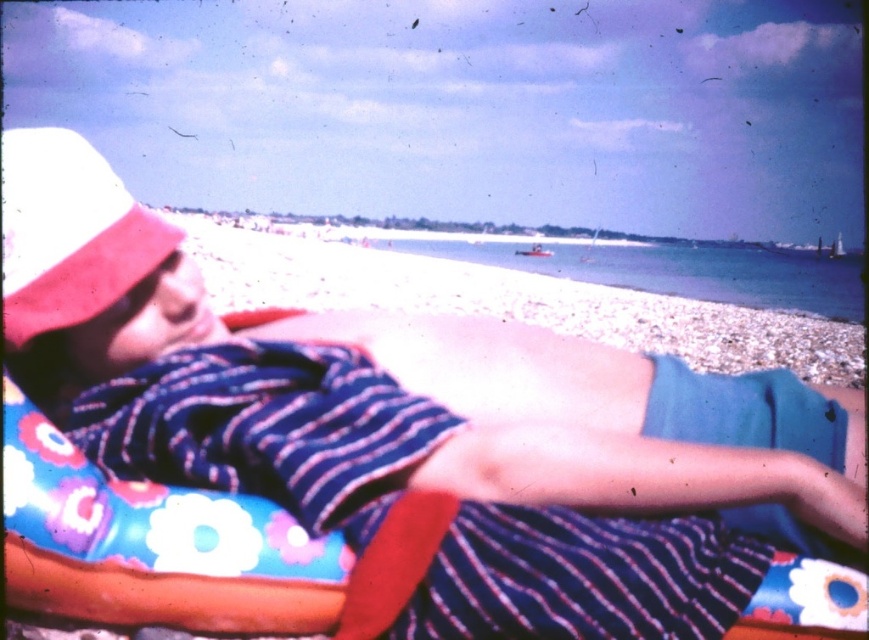
You are standing on the beach and see two points marked on the ground. The first point is at coordinate point [313,241] and the second is at point [98,241]. Which point is closer to you?

Point [313,241] is further to the viewer than point [98,241], so the closer point to you is point [98,241].

You are standing on the beach and want to place a 1.5 meter long umbrella between the white sand at center and the pink fabric hat at upper left. Can you fit the umbrella horizontally between them without it touching either object?

The distance between the white sand at center and the pink fabric hat at upper left is 13.21 meters, which is significantly larger than the umbrella length of 1.5 meters. Therefore, the umbrella can be placed horizontally between them without touching either object.